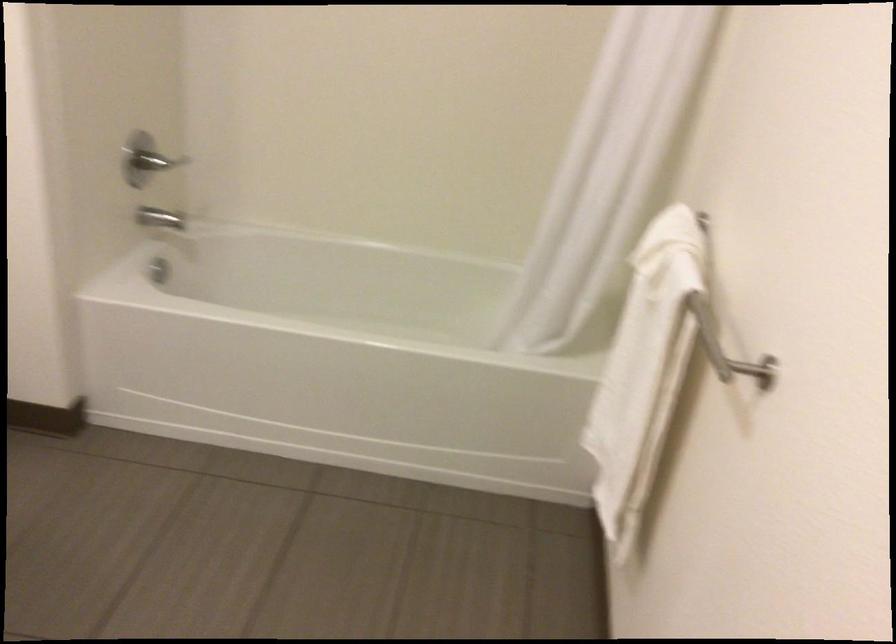
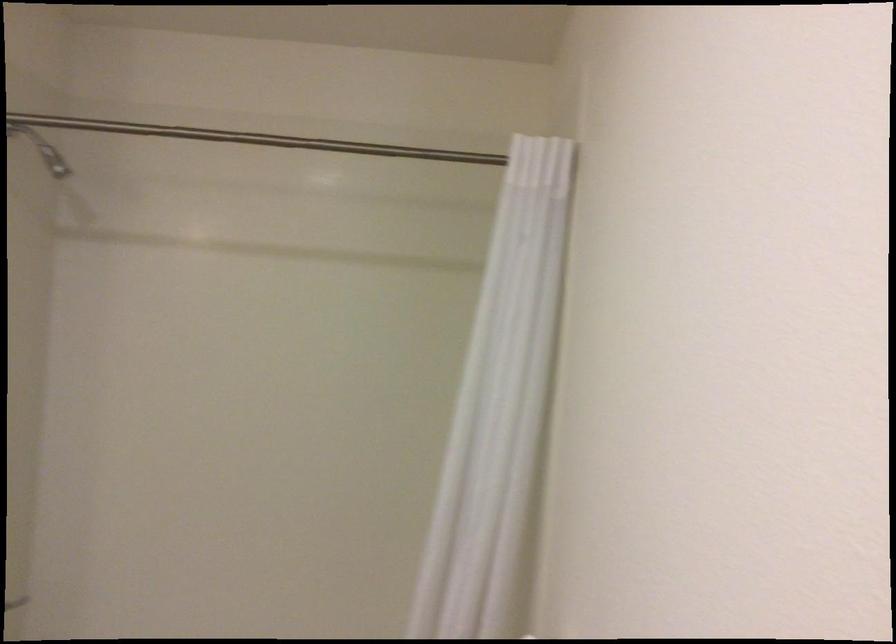
Question: The images are taken continuously from a first-person perspective. In which direction are you moving?

Choices:
 (A) Left
 (B) Right
 (C) Forward
 (D) Backward

Answer: (B)